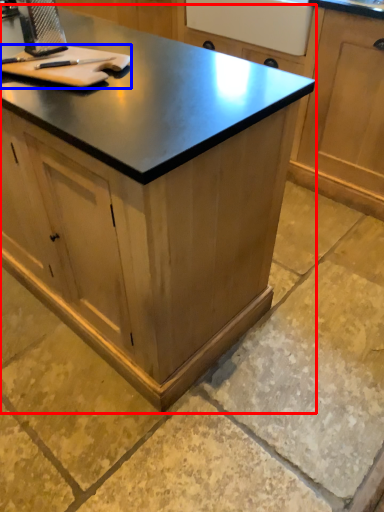
Question: Which object appears closest to the camera in this image, cabinetry (highlighted by a red box) or cutting board (highlighted by a blue box)?

Choices:
 (A) cabinetry
 (B) cutting board

Answer: (A)